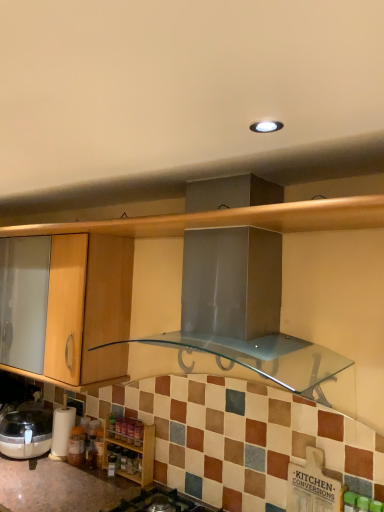
Question: Should I look upward or downward to see black glass gas stove at lower center?

Choices:
 (A) up
 (B) down

Answer: (B)

Question: Considering the relative sizes of black glass gas stove at lower center and wooden spice rack at lower left in the image provided, is black glass gas stove at lower center taller than wooden spice rack at lower left?

Choices:
 (A) yes
 (B) no

Answer: (B)

Question: Is black glass gas stove at lower center facing towards wooden spice rack at lower left?

Choices:
 (A) no
 (B) yes

Answer: (A)

Question: Considering the relative sizes of black glass gas stove at lower center and wooden spice rack at lower left in the image provided, is black glass gas stove at lower center bigger than wooden spice rack at lower left?

Choices:
 (A) no
 (B) yes

Answer: (B)

Question: From the image's perspective, is black glass gas stove at lower center located above wooden spice rack at lower left?

Choices:
 (A) yes
 (B) no

Answer: (B)

Question: Is the depth of black glass gas stove at lower center greater than that of wooden spice rack at lower left?

Choices:
 (A) yes
 (B) no

Answer: (B)

Question: Does black glass gas stove at lower center have a lesser width compared to wooden spice rack at lower left?

Choices:
 (A) no
 (B) yes

Answer: (A)

Question: Is white paper towel holder at lower left with black glass gas stove at lower center?

Choices:
 (A) no
 (B) yes

Answer: (A)

Question: From the image's perspective, does white paper towel holder at lower left appear lower than black glass gas stove at lower center?

Choices:
 (A) no
 (B) yes

Answer: (A)

Question: From a real-world perspective, is white paper towel holder at lower left over black glass gas stove at lower center?

Choices:
 (A) yes
 (B) no

Answer: (A)

Question: Is white paper towel holder at lower left positioned with its back to black glass gas stove at lower center?

Choices:
 (A) no
 (B) yes

Answer: (A)

Question: Considering the relative sizes of white paper towel holder at lower left and black glass gas stove at lower center in the image provided, is white paper towel holder at lower left shorter than black glass gas stove at lower center?

Choices:
 (A) yes
 (B) no

Answer: (B)

Question: Does white paper towel holder at lower left appear on the right side of black glass gas stove at lower center?

Choices:
 (A) yes
 (B) no

Answer: (B)

Question: From a real-world perspective, is wooden spice rack at lower left positioned over white paper towel holder at lower left based on gravity?

Choices:
 (A) no
 (B) yes

Answer: (A)